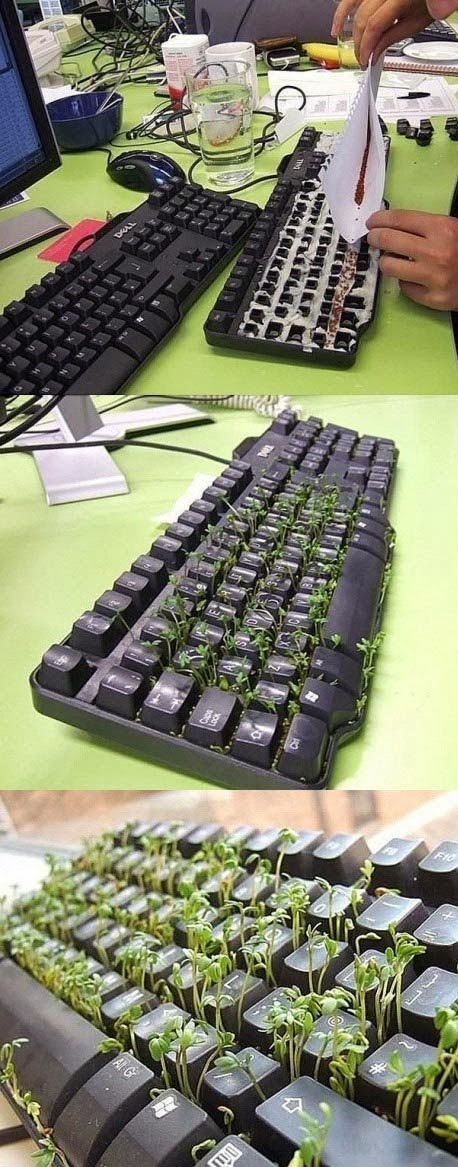
The height and width of the screenshot is (1167, 458). I want to click on keyboards, so click(x=283, y=945), click(x=264, y=662), click(x=122, y=281), click(x=315, y=229).